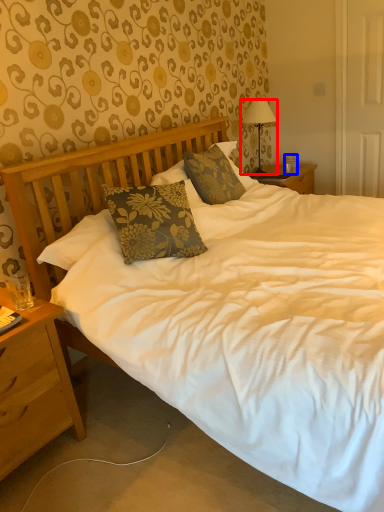
Question: Which point is further to the camera, lamp (highlighted by a red box) or coffee cup (highlighted by a blue box)?

Choices:
 (A) lamp
 (B) coffee cup

Answer: (B)